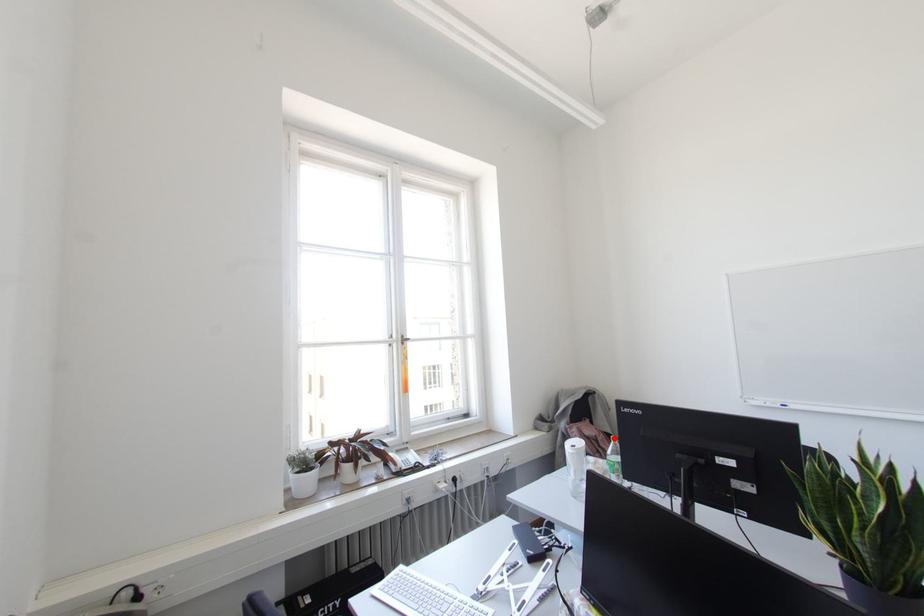
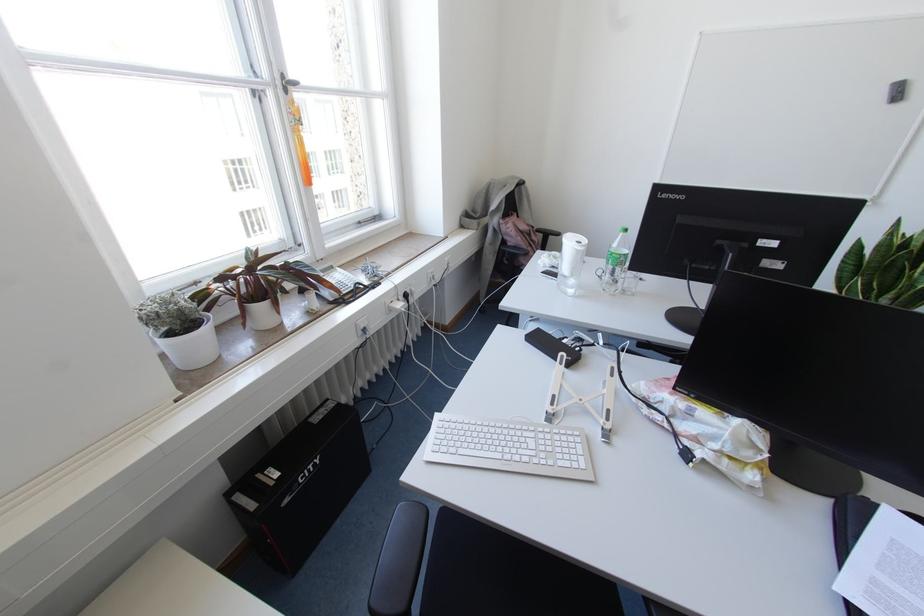
Where in the second image is the point corresponding to the highlighted location from the first image?

(625, 229)